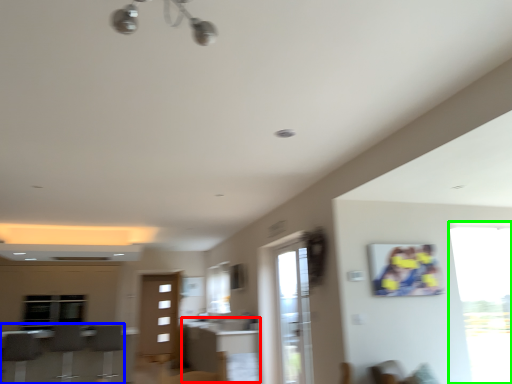
Question: Based on their relative distances, which object is nearer to table (highlighted by a red box)? Choose from furniture (highlighted by a blue box) and window (highlighted by a green box).

Choices:
 (A) furniture
 (B) window

Answer: (A)